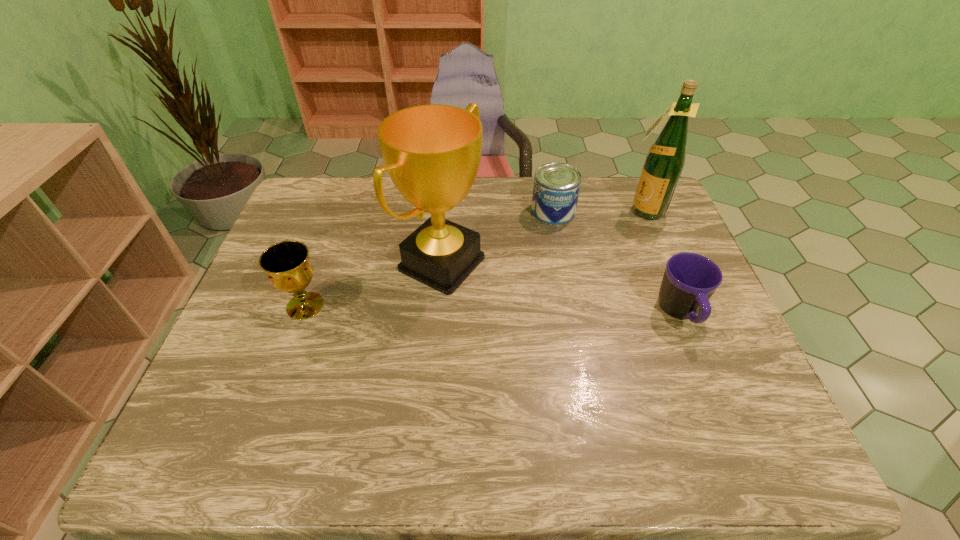
Locate an element on the screen. The width and height of the screenshot is (960, 540). vacant region located 0.370m on the front-facing side of the liquor is located at coordinates (562, 281).

I want to click on free space located on the front-facing side of the award, so click(531, 310).

Where is `free location located 0.290m on the front-facing side of the award`? Image resolution: width=960 pixels, height=540 pixels. free location located 0.290m on the front-facing side of the award is located at coordinates (578, 332).

Identify the location of free space located on the front-facing side of the award. The height and width of the screenshot is (540, 960). (527, 308).

The width and height of the screenshot is (960, 540). I want to click on blank area located 0.150m on the front label of the can, so click(534, 255).

Where is `vacant space located 0.060m on the front label of the can`? This screenshot has height=540, width=960. vacant space located 0.060m on the front label of the can is located at coordinates (542, 237).

Where is `vacant position located on the front label of the can`? This screenshot has width=960, height=540. vacant position located on the front label of the can is located at coordinates (525, 274).

Where is `liquor that is at the far edge`? liquor that is at the far edge is located at coordinates (664, 163).

Where is `can at the far edge`? Image resolution: width=960 pixels, height=540 pixels. can at the far edge is located at coordinates (556, 188).

Image resolution: width=960 pixels, height=540 pixels. Find the location of `object located in the left edge section of the desktop`. object located in the left edge section of the desktop is located at coordinates (287, 264).